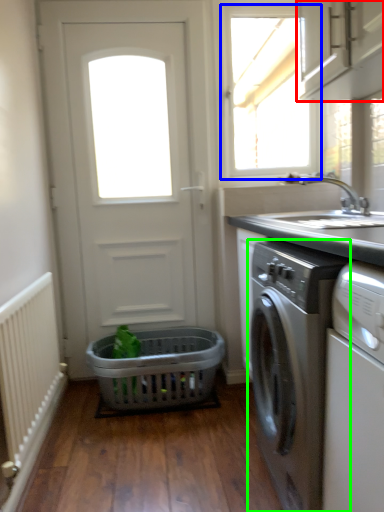
Question: Which is nearer to the cabinetry (highlighted by a red box)? window (highlighted by a blue box) or washing machine (highlighted by a green box).

Choices:
 (A) window
 (B) washing machine

Answer: (B)